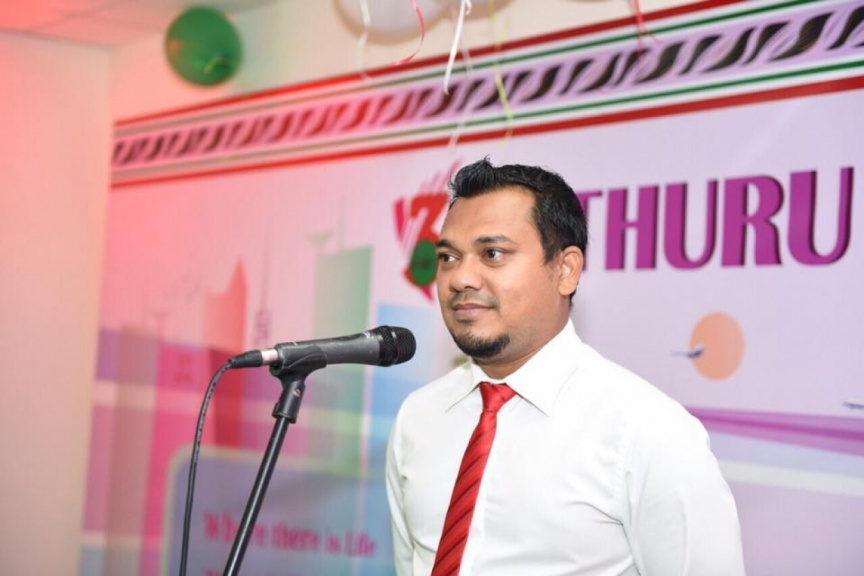
Locate an element on the screen. The image size is (864, 576). wall is located at coordinates (48, 256).